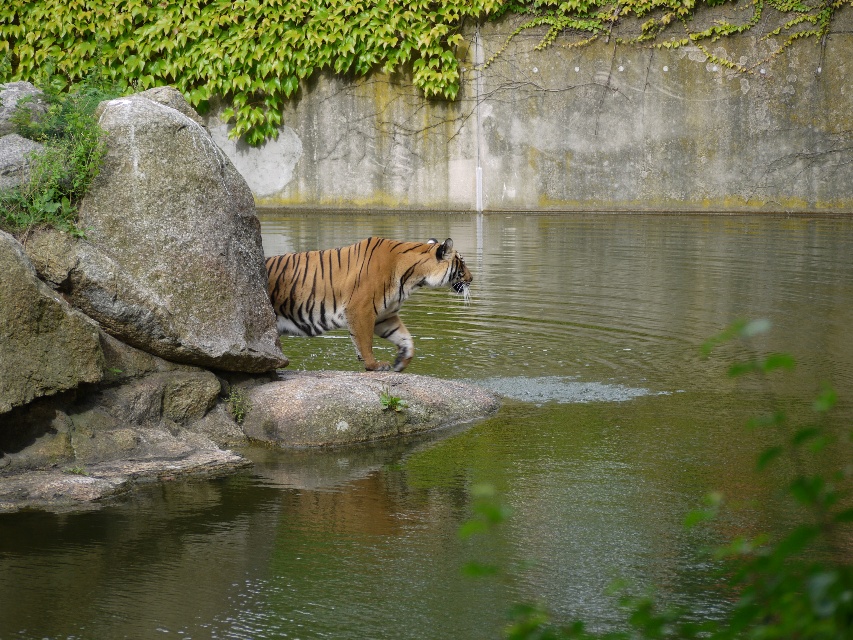
Question: Which is nearer to the gray rough rock at left?

Choices:
 (A) green liquid water at center
 (B) green leafy ivy at upper center
 (C) orange striped tiger at center

Answer: (C)

Question: Does green liquid water at center lie in front of green leafy ivy at upper center?

Choices:
 (A) no
 (B) yes

Answer: (B)

Question: Considering the real-world distances, which object is farthest from the gray rough rock at left?

Choices:
 (A) green liquid water at center
 (B) green leafy ivy at upper center

Answer: (B)

Question: Can you confirm if green leafy ivy at upper center is wider than orange striped tiger at center?

Choices:
 (A) no
 (B) yes

Answer: (B)

Question: Observing the image, what is the correct spatial positioning of green leafy ivy at upper center in reference to gray rough rock at left?

Choices:
 (A) right
 (B) left

Answer: (B)

Question: Which object is farther from the camera taking this photo?

Choices:
 (A) gray rough rock at left
 (B) green liquid water at center
 (C) green leafy ivy at upper center

Answer: (C)